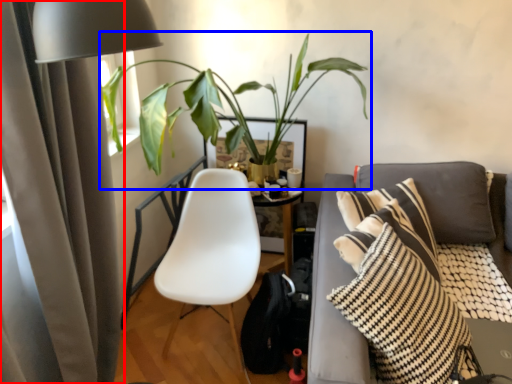
Question: Which of the following is the farthest to the observer, curtain (highlighted by a red box) or houseplant (highlighted by a blue box)?

Choices:
 (A) curtain
 (B) houseplant

Answer: (B)